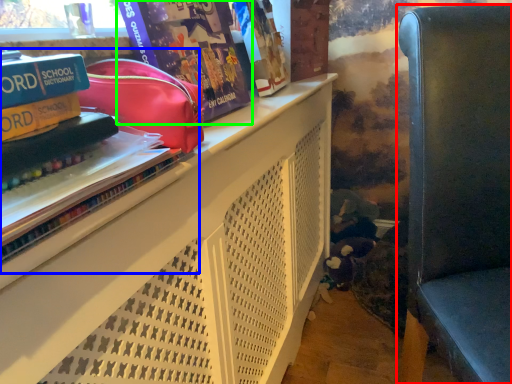
Question: Considering the real-world distances, which object is farthest from furniture (highlighted by a red box)? book (highlighted by a blue box) or comic book (highlighted by a green box)?

Choices:
 (A) book
 (B) comic book

Answer: (A)